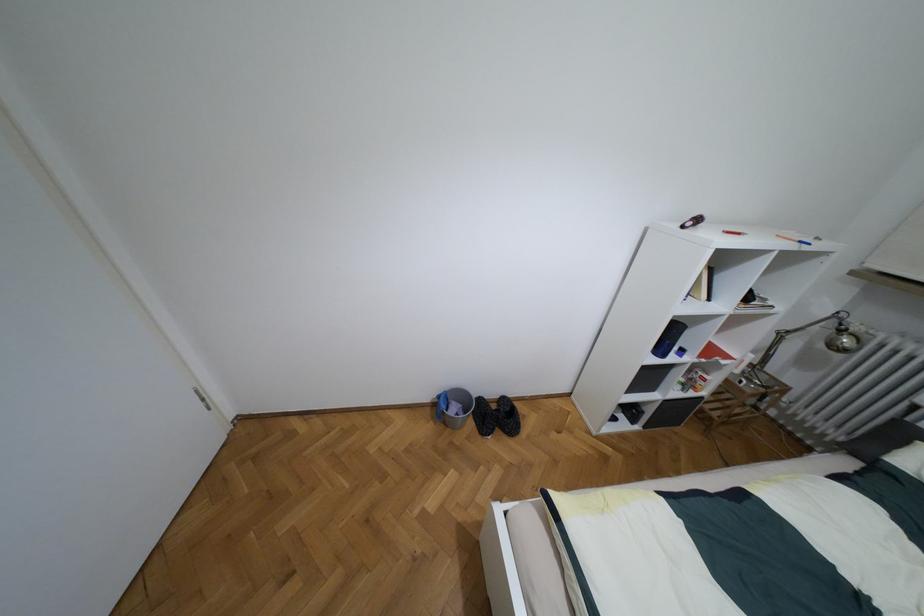
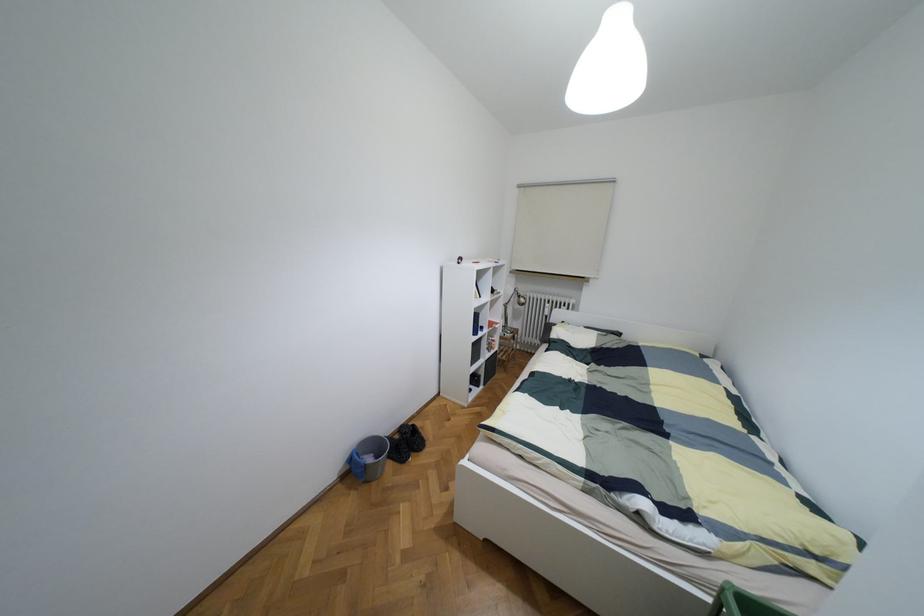
Find the pixel in the second image that matches the point at 840,330 in the first image.

(517, 296)